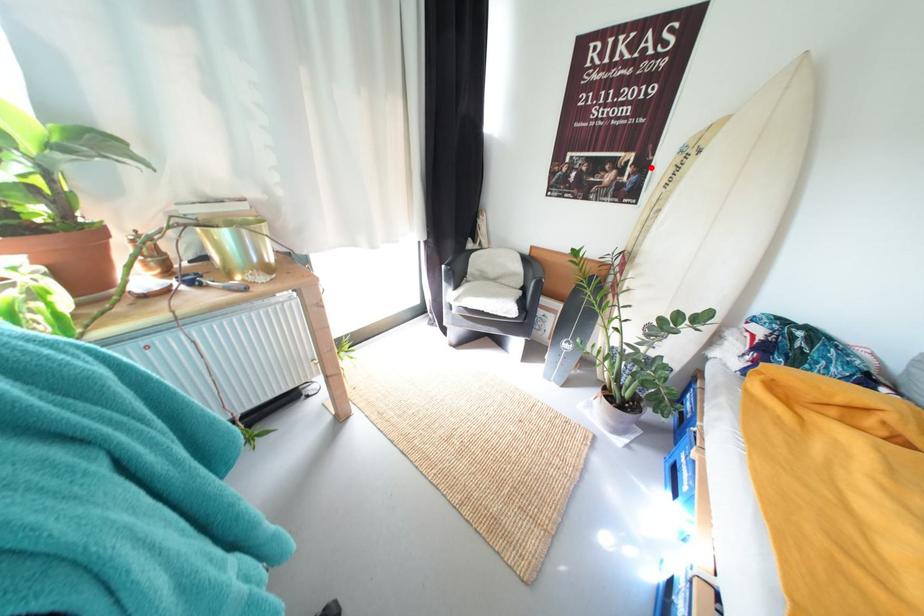
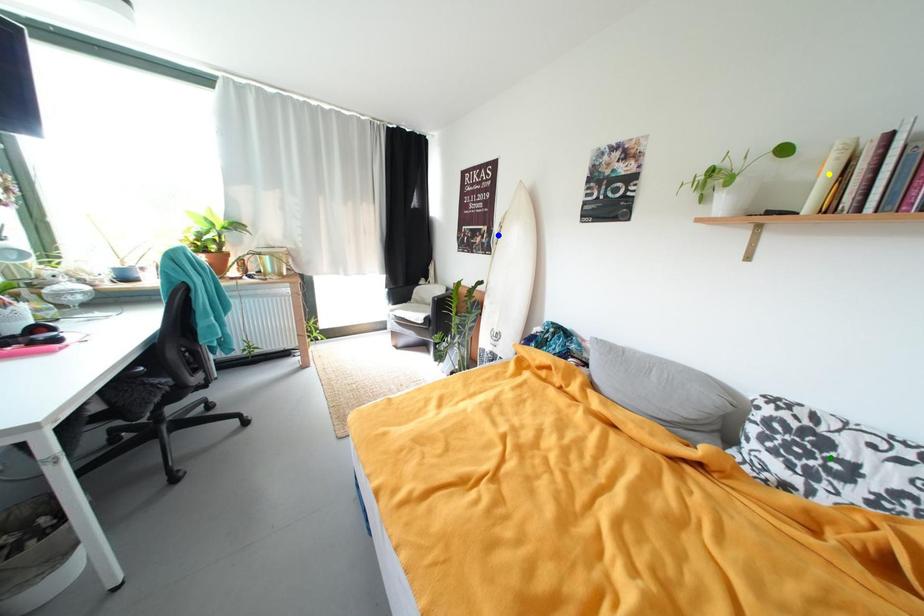
Question: I am providing you with two images of the same scene from different viewpoints. A red point is marked on the first image. You are given multiple points on the second image. In image 2, which mark is for the same physical point as the one in image 1?

Choices:
 (A) yellow point
 (B) blue point
 (C) green point

Answer: (B)